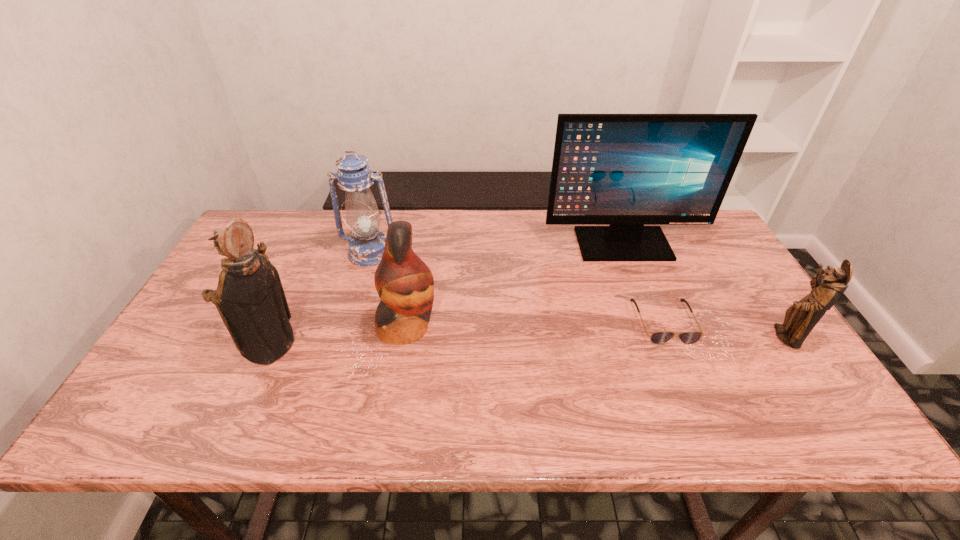
Please determine a free point for an extra figurine to ensure balance. Please provide its 2D coordinates. Your answer should be formatted as a tuple, i.e. [(x, y)], where the tuple contains the x and y coordinates of a point satisfying the conditions above.

[(530, 341)]